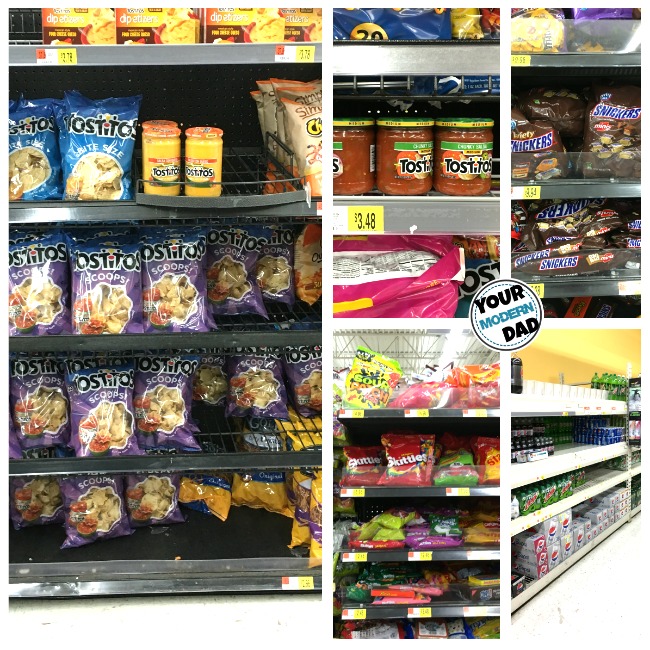
Where is `shelves of snickers`? shelves of snickers is located at coordinates (585, 133), (565, 240).